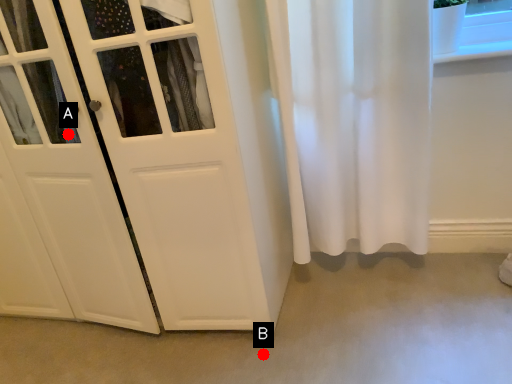
Question: Two points are circled on the image, labeled by A and B beside each circle. Which of the following is the closest to the observer?

Choices:
 (A) A is closer
 (B) B is closer

Answer: (A)